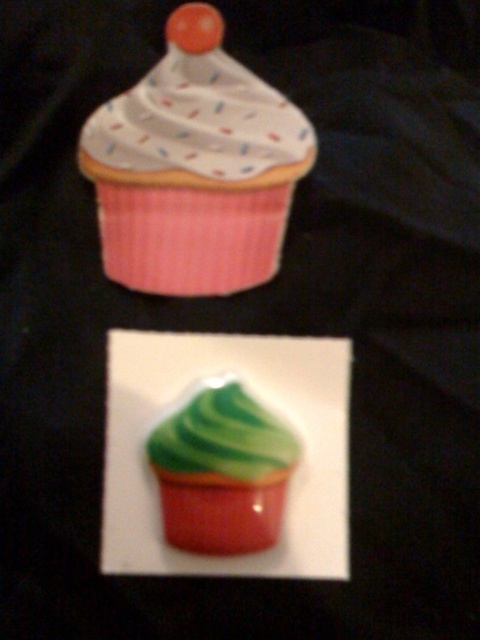
You are a food critic standing in front of two cupcakes. You want to take a closer look at the matte pink cupcake at upper center and the green glossy cupcake at center. Which one do you need to lean forward more to examine closely?

You need to lean forward more to examine the green glossy cupcake at center closely because it is farther away from you compared to the matte pink cupcake at upper center.

You are looking at the cupcakes and want to place a sticker on the point that is closer to you. Which point should you choose between point (146,164) and point (229,426)?

Point (146,164) is closer to the viewer than point (229,426), so you should place the sticker on point (146,164).

You are a baker who wants to place a small chocolate piece between the matte pink cupcake at upper center and the white dotted frosting at upper center. Given that the chocolate piece is 1 inch in diameter, will it fit in the space between them?

The space between the matte pink cupcake at upper center and the white dotted frosting at upper center is 1.06 inches. Since the chocolate piece is 1 inch in diameter, it will fit with a small amount of space remaining.